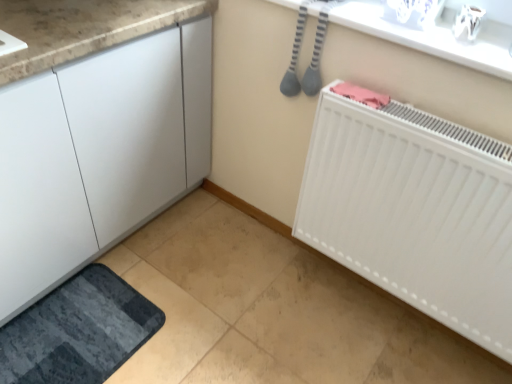
Question: Should I look upward or downward to see white glossy counter top at upper center?

Choices:
 (A) down
 (B) up

Answer: (B)

Question: Considering the relative sizes of white matte radiator at lower right and white glossy counter top at upper center in the image provided, is white matte radiator at lower right thinner than white glossy counter top at upper center?

Choices:
 (A) yes
 (B) no

Answer: (A)

Question: Is white matte radiator at lower right at the left side of white glossy counter top at upper center?

Choices:
 (A) no
 (B) yes

Answer: (A)

Question: Is white matte radiator at lower right positioned behind white glossy counter top at upper center?

Choices:
 (A) no
 (B) yes

Answer: (A)

Question: Is white matte radiator at lower right beside white glossy counter top at upper center?

Choices:
 (A) no
 (B) yes

Answer: (A)

Question: Is white matte radiator at lower right shorter than white glossy counter top at upper center?

Choices:
 (A) no
 (B) yes

Answer: (A)

Question: From the image's perspective, does white matte radiator at lower right appear higher than white glossy counter top at upper center?

Choices:
 (A) yes
 (B) no

Answer: (B)

Question: Does dark gray textured bath mat at lower left turn towards white glossy counter top at upper center?

Choices:
 (A) yes
 (B) no

Answer: (B)

Question: Is dark gray textured bath mat at lower left completely or partially outside of white glossy counter top at upper center?

Choices:
 (A) no
 (B) yes

Answer: (B)

Question: Is white glossy counter top at upper center completely or partially inside dark gray textured bath mat at lower left?

Choices:
 (A) no
 (B) yes

Answer: (A)

Question: Can you confirm if dark gray textured bath mat at lower left is bigger than white glossy counter top at upper center?

Choices:
 (A) yes
 (B) no

Answer: (A)

Question: Is dark gray textured bath mat at lower left not close to white glossy counter top at upper center?

Choices:
 (A) yes
 (B) no

Answer: (A)

Question: From a real-world perspective, is dark gray textured bath mat at lower left below white glossy counter top at upper center?

Choices:
 (A) yes
 (B) no

Answer: (A)

Question: Is white matte radiator at lower right looking in the opposite direction of dark gray textured bath mat at lower left?

Choices:
 (A) yes
 (B) no

Answer: (B)